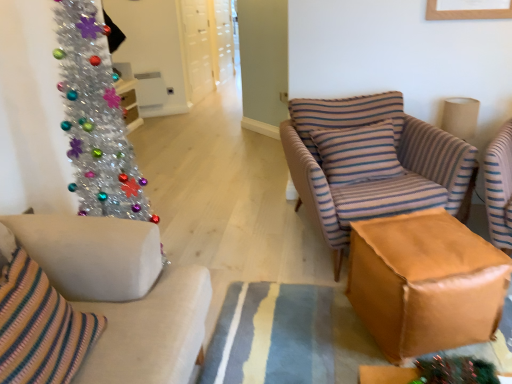
You are a GUI agent. You are given a task and a screenshot of the screen. Output one action in this format:
    pyautogui.click(x=<x>, y=<y>)
    Task: Click on the free spot to the left of striped fabric armchair at center
    This screenshot has height=384, width=512.
    Given the screenshot: What is the action you would take?
    pyautogui.click(x=234, y=244)